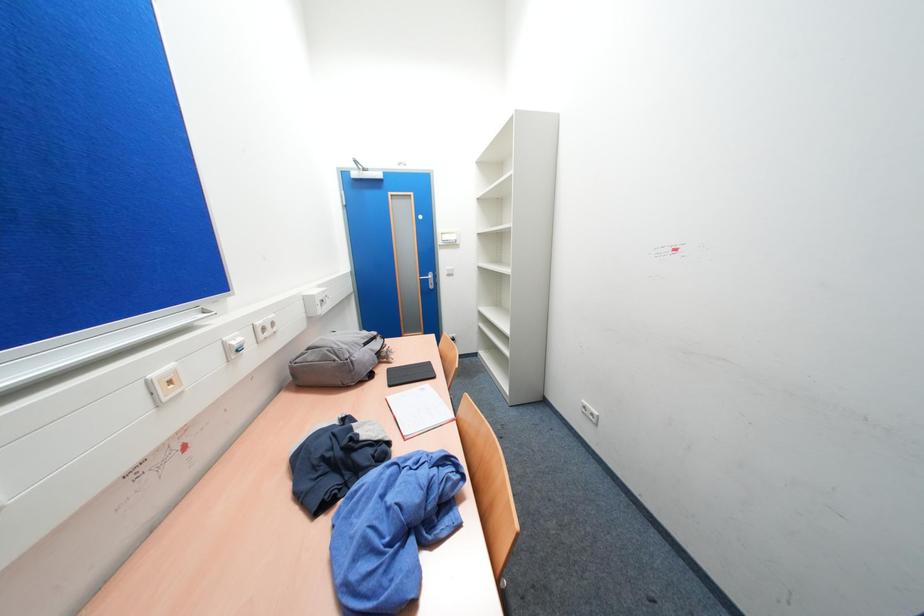
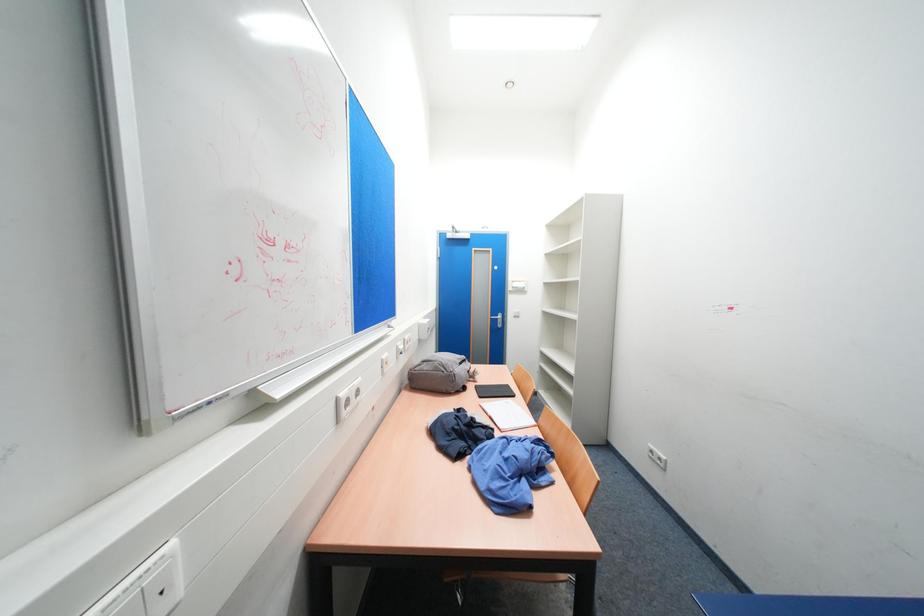
Question: The images are taken continuously from a first-person perspective. In which direction is your viewpoint rotating?

Choices:
 (A) Left
 (B) Right
 (C) Up
 (D) Down

Answer: (A)